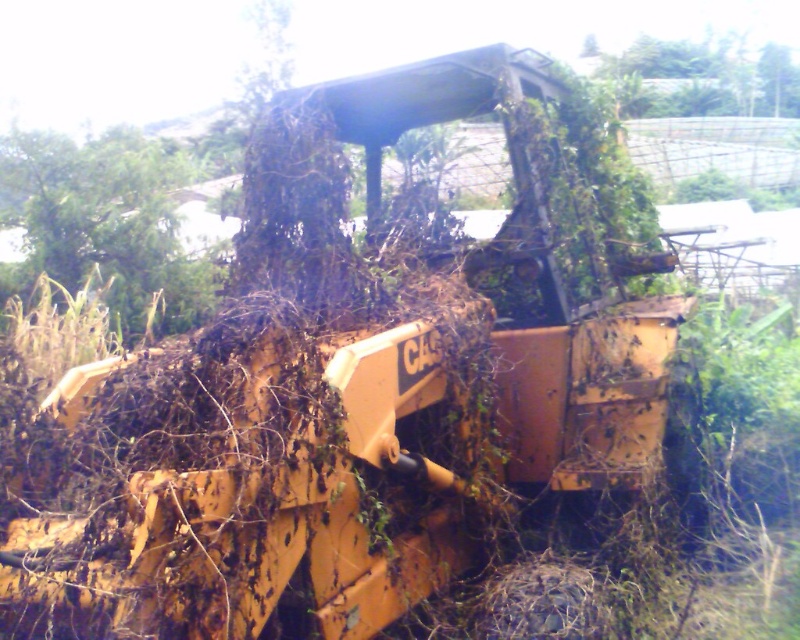
Who is positioned more to the right, green leafy tree at upper left or green leafy tree at upper center?

From the viewer's perspective, green leafy tree at upper center appears more on the right side.

Does green leafy tree at upper left have a greater width compared to green leafy tree at upper center?

No.

Identify the location of green leafy tree at upper left. This screenshot has height=640, width=800. (106, 218).